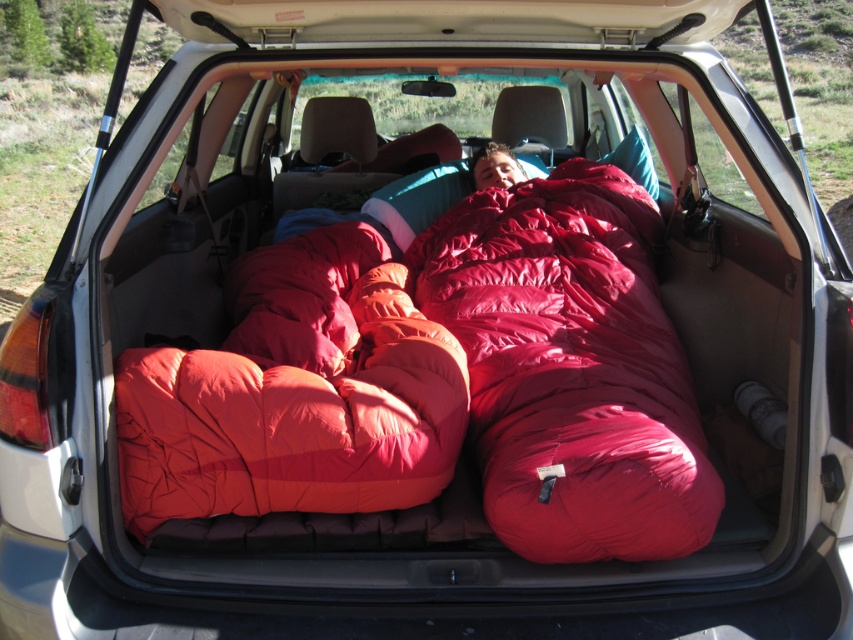
Question: Can you confirm if shiny red sleeping bag at center is positioned below smooth red sleeping bag at center?

Choices:
 (A) no
 (B) yes

Answer: (B)

Question: Among these objects, which one is nearest to the camera?

Choices:
 (A) matte orange sleeping bag at center
 (B) smooth red sleeping bag at center
 (C) shiny red sleeping bag at center

Answer: (C)

Question: Can you confirm if shiny red sleeping bag at center is positioned to the right of matte orange sleeping bag at center?

Choices:
 (A) no
 (B) yes

Answer: (B)

Question: Which of the following is the farthest from the observer?

Choices:
 (A) smooth red sleeping bag at center
 (B) matte orange sleeping bag at center
 (C) shiny red sleeping bag at center

Answer: (A)

Question: Can you confirm if shiny red sleeping bag at center is positioned to the right of smooth red sleeping bag at center?

Choices:
 (A) yes
 (B) no

Answer: (A)

Question: Which object is positioned farthest from the shiny red sleeping bag at center?

Choices:
 (A) smooth red sleeping bag at center
 (B) matte orange sleeping bag at center

Answer: (A)